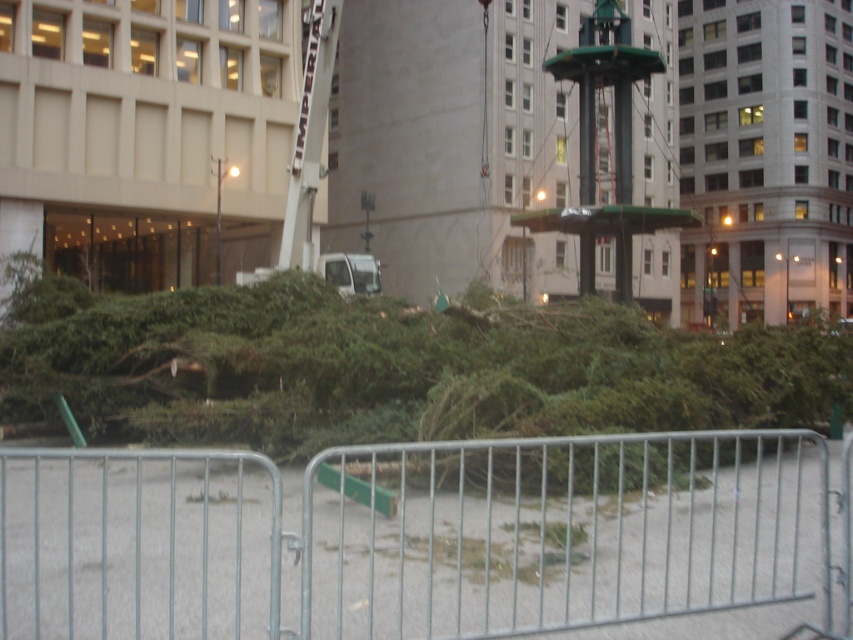
Between point (364, 612) and point (71, 346), which one is positioned behind?

Point (71, 346)

Can you confirm if metal at center is wider than green leafy tree at center?

In fact, metal at center might be narrower than green leafy tree at center.

The image size is (853, 640). In order to click on metal at center in this screenshot , I will do `click(416, 536)`.